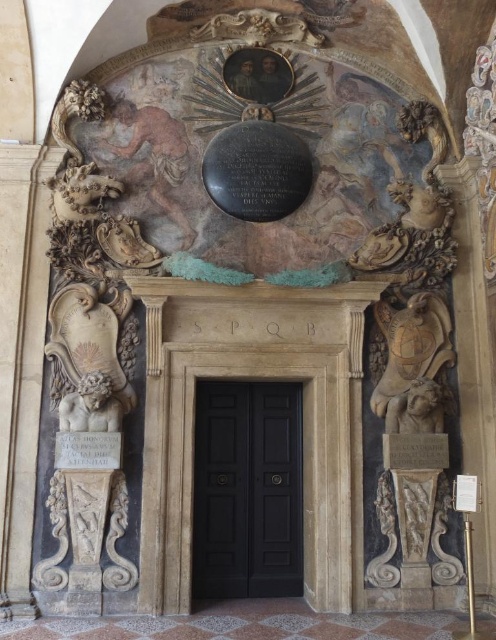
Can you confirm if black wooden door at center is shorter than matte stone plaque at right?

No.

What do you see at coordinates (248, 490) in the screenshot?
I see `black wooden door at center` at bounding box center [248, 490].

What are the coordinates of `black wooden door at center` in the screenshot? It's located at (248, 490).

Consider the image. Can you confirm if black wooden door at center is wider than white marble plaque at lower left?

Indeed, black wooden door at center has a greater width compared to white marble plaque at lower left.

Is black wooden door at center in front of white marble plaque at lower left?

No, it is behind white marble plaque at lower left.

Does point (263, 561) come closer to viewer compared to point (96, 467)?

That is False.

This screenshot has width=496, height=640. Find the location of `black wooden door at center`. black wooden door at center is located at coordinates (248, 490).

Consider the image. Can you confirm if white marble plaque at lower left is positioned below matte stone plaque at right?

Incorrect, white marble plaque at lower left is not positioned below matte stone plaque at right.

Find the location of a particular element. This screenshot has width=496, height=640. white marble plaque at lower left is located at coordinates (87, 451).